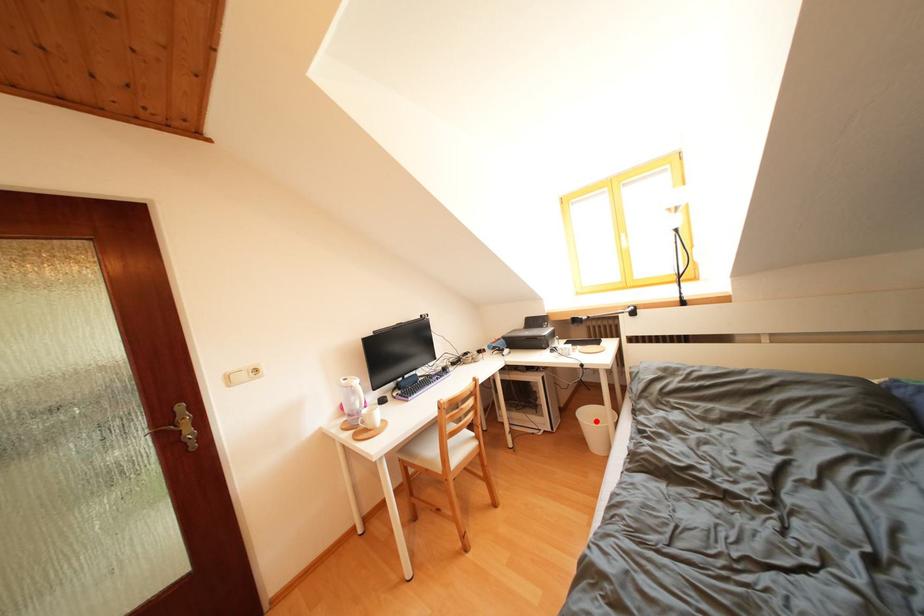
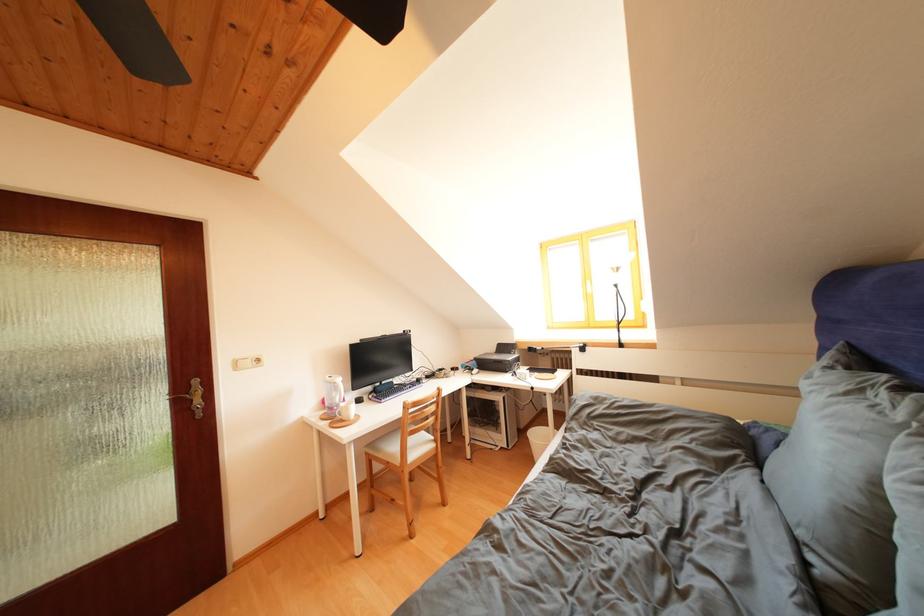
The point at the highlighted location is marked in the first image. Where is the corresponding point in the second image?

(542, 439)